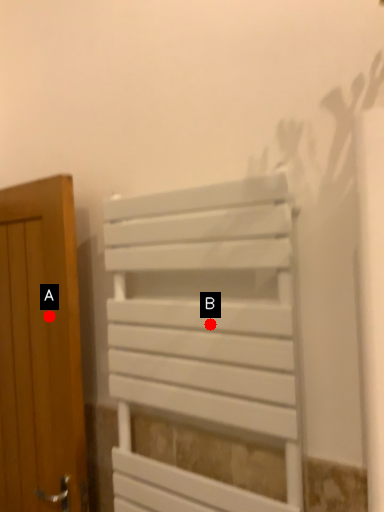
Question: Two points are circled on the image, labeled by A and B beside each circle. Among these points, which one is farthest from the camera?

Choices:
 (A) A is further
 (B) B is further

Answer: (A)